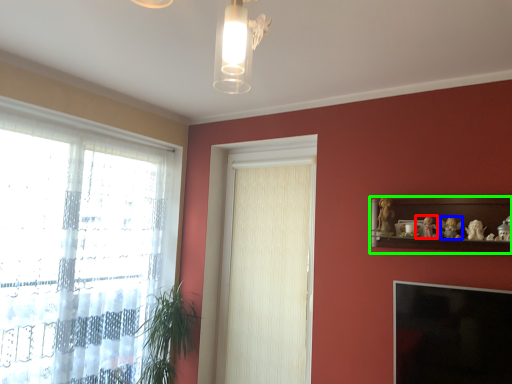
Question: Based on their relative distances, which object is nearer to toy (highlighted by a red box)? Choose from toy (highlighted by a blue box) and shelf (highlighted by a green box).

Choices:
 (A) toy
 (B) shelf

Answer: (A)